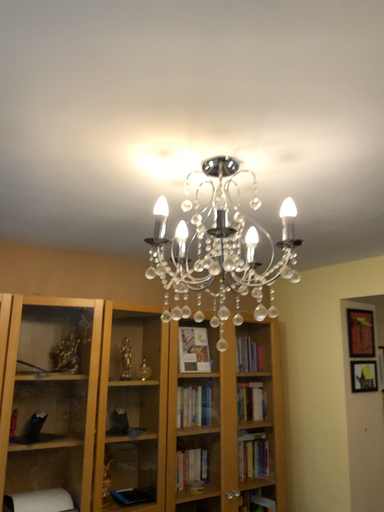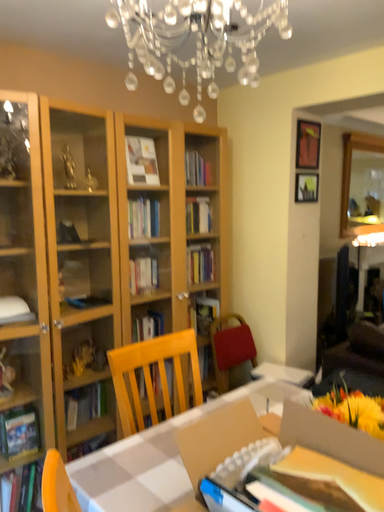
Question: How did the camera likely rotate when shooting the video?

Choices:
 (A) rotated downward
 (B) rotated upward

Answer: (A)